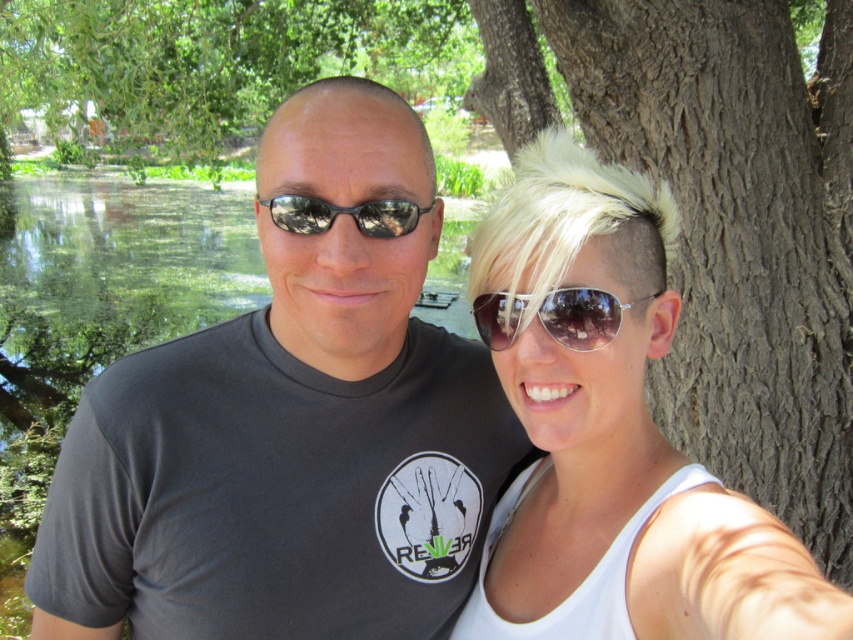
Question: Is matte gray t-shirt at center to the left of shiny silver sunglasses at center from the viewer's perspective?

Choices:
 (A) no
 (B) yes

Answer: (B)

Question: Among these points, which one is farthest from the camera?

Choices:
 (A) (340, 342)
 (B) (376, 234)

Answer: (A)

Question: Which of the following is the farthest from the observer?

Choices:
 (A) (456, 433)
 (B) (712, 624)
 (C) (544, 307)

Answer: (A)

Question: Can you confirm if matte gray t-shirt at center is positioned below shiny silver sunglasses at center?

Choices:
 (A) yes
 (B) no

Answer: (A)

Question: Among these points, which one is farthest from the camera?

Choices:
 (A) (653, 426)
 (B) (306, 420)
 (C) (514, 337)
 (D) (315, 196)

Answer: (A)

Question: Is blonde hair at center positioned before shiny silver sunglasses at center?

Choices:
 (A) no
 (B) yes

Answer: (B)